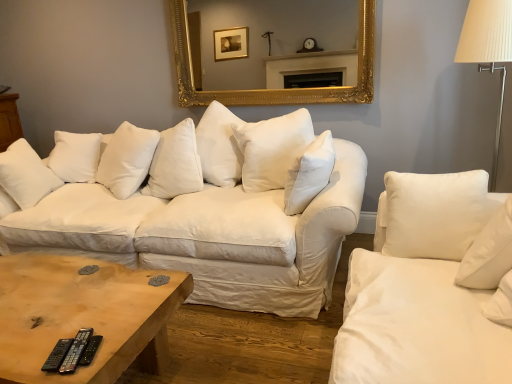
Where is `free space to the left of black plastic remote at lower left, which ranks as the 2th remote in left-to-right order`? This screenshot has height=384, width=512. free space to the left of black plastic remote at lower left, which ranks as the 2th remote in left-to-right order is located at coordinates (38, 344).